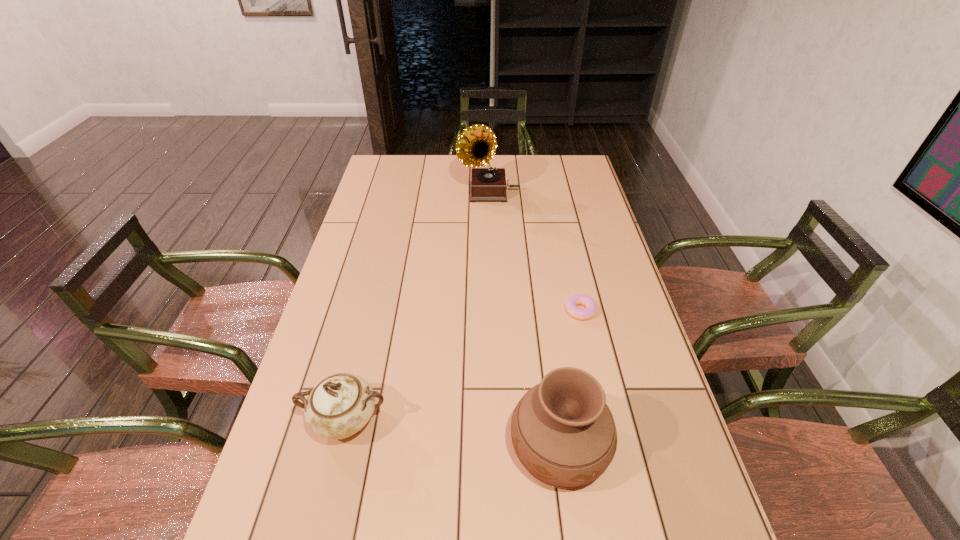
At what (x,y) coordinates should I click in order to perform the action: click on vacant space situated on the back of the urn. Please return your answer as a coordinate pair (x, y). The height and width of the screenshot is (540, 960). Looking at the image, I should click on (550, 376).

Locate an element on the screen. The height and width of the screenshot is (540, 960). vacant position located 0.150m on the right of the third tallest object is located at coordinates (456, 420).

Where is `vacant space located on the left of the doughnut`? The image size is (960, 540). vacant space located on the left of the doughnut is located at coordinates (458, 310).

Find the location of a particular element. The width and height of the screenshot is (960, 540). object at the far edge is located at coordinates (476, 145).

Image resolution: width=960 pixels, height=540 pixels. Identify the location of object situated at the left edge. (340, 405).

At what (x,y) coordinates should I click in order to perform the action: click on urn at the right edge. Please return your answer as a coordinate pair (x, y). Looking at the image, I should click on (563, 432).

The width and height of the screenshot is (960, 540). Find the location of `doughnut that is at the right edge`. doughnut that is at the right edge is located at coordinates (579, 299).

This screenshot has width=960, height=540. In the image, there is a desktop. Find the location of `vacant space at the far edge`. vacant space at the far edge is located at coordinates (539, 159).

At what (x,y) coordinates should I click in order to perform the action: click on vacant space at the left edge. Please return your answer as a coordinate pair (x, y). Looking at the image, I should click on (362, 313).

Identify the location of blank space at the right edge of the desktop. (570, 252).